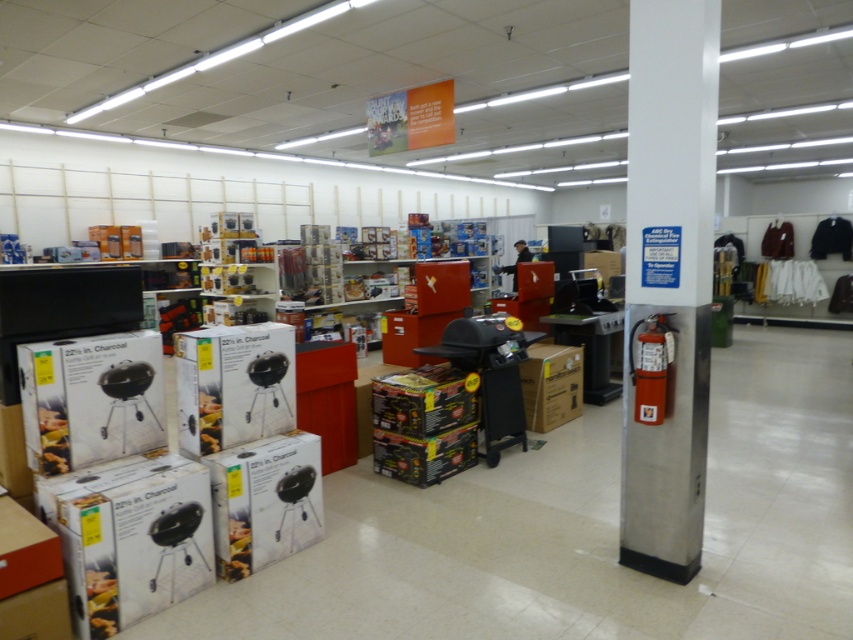
You are a customer in the store and want to pick up the white matte grill at lower left. To reach it, you need to move around the white cardboard box at lower left. Which direction should you move relative to the box?

Since the white cardboard box at lower left is to the left of the white matte grill at lower left, you should move to the right of the box to reach the grill.

You are a store employee who needs to reach the white metallic pillar at center to adjust its position. You have a 7.5 feet long ladder. Is the ladder long enough to reach the pillar?

The white metallic pillar at center and camera are 8.20 feet apart. The ladder is only 7.5 feet long, so it is not long enough to reach the pillar.

You are a delivery person who just arrived at the store with a new shipment of grills. You need to place the new grill in the same area as the existing ones. The new grill comes in a box that is the same size as the white cardboard box at lower left. Will the existing white matte grill at lower left fit inside the new box?

The white cardboard box at lower left is larger in size than the white matte grill at lower left, so the existing white matte grill at lower left can fit inside the new box since it is the same size as the original box.